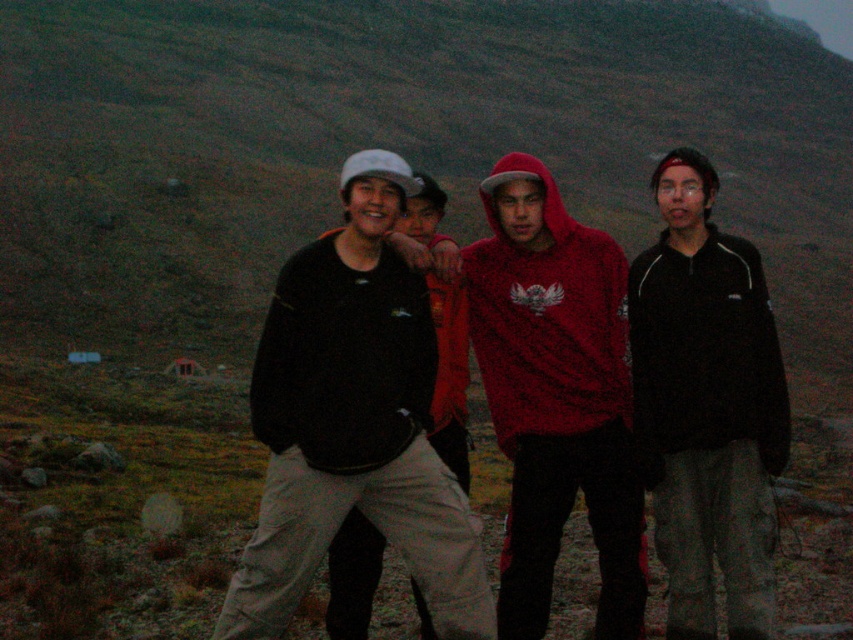
Question: Does black fleece jacket at right appear on the right side of matte black jacket at center?

Choices:
 (A) no
 (B) yes

Answer: (B)

Question: Which of the following is the farthest from the observer?

Choices:
 (A) red hoodie at center
 (B) black fleece jacket at right
 (C) matte black shirt at center

Answer: (A)

Question: Does black fleece jacket at right have a lesser width compared to matte black jacket at center?

Choices:
 (A) yes
 (B) no

Answer: (A)

Question: Estimate the real-world distances between objects in this image. Which object is closer to the matte black shirt at center?

Choices:
 (A) black fleece jacket at right
 (B) matte black jacket at center

Answer: (B)

Question: Is matte black shirt at center further to the viewer compared to black fleece jacket at right?

Choices:
 (A) yes
 (B) no

Answer: (B)

Question: Which of the following is the closest to the observer?

Choices:
 (A) (631, 355)
 (B) (363, 461)
 (C) (606, 593)
 (D) (419, 268)

Answer: (B)